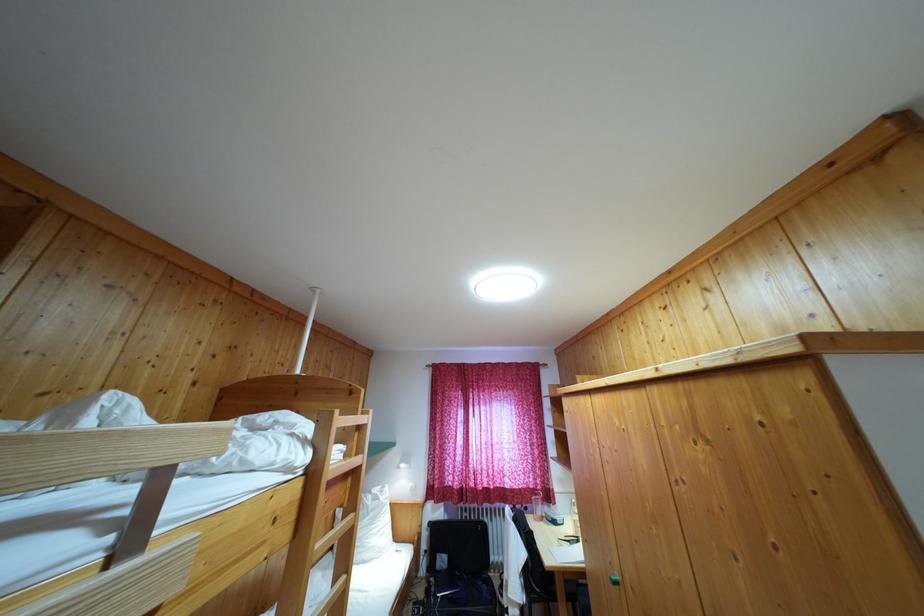
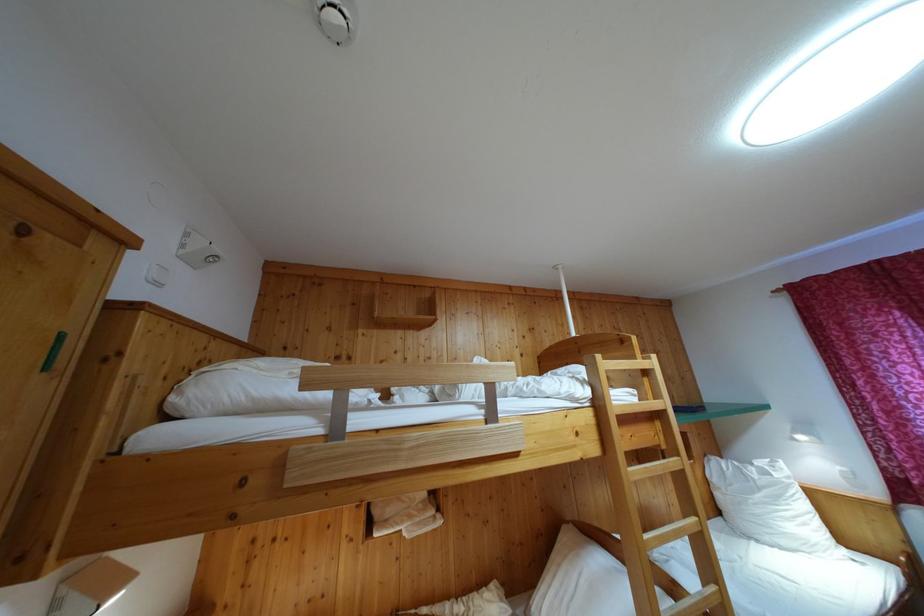
Locate, in the second image, the point that corresponds to (x=363, y=474) in the first image.

(669, 418)